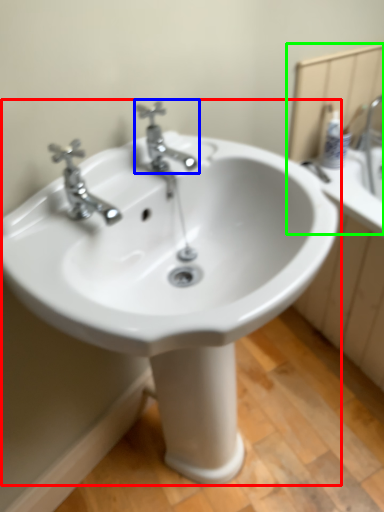
Question: Which is farther away from sink (highlighted by a red box)? tap (highlighted by a blue box) or mirror (highlighted by a green box)?

Choices:
 (A) tap
 (B) mirror

Answer: (B)